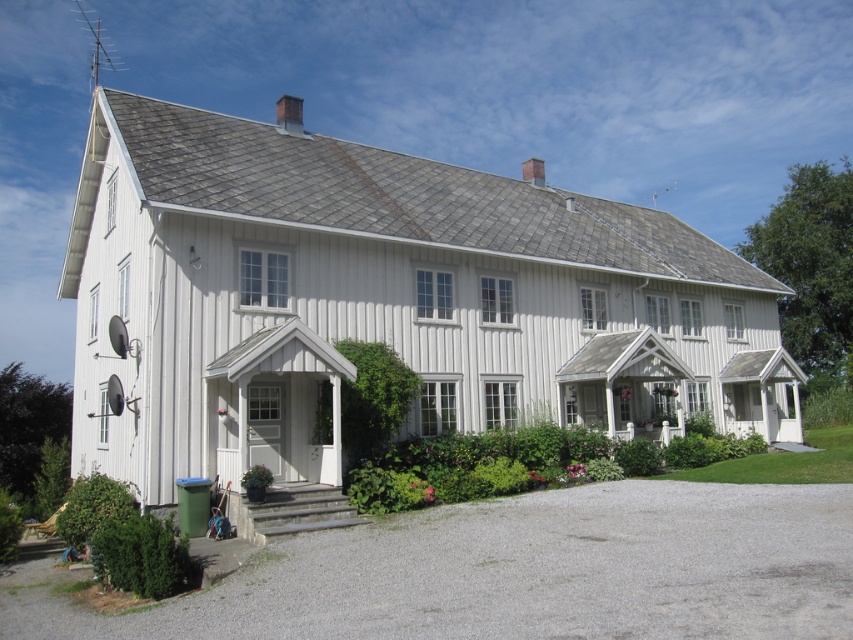
You are a delivery person approaching the house and need to park your vehicle. The gray gravel driveway at lower center and the gray stone steps at lower center are both visible. Which path is wider and more suitable for parking?

The gray gravel driveway at lower center is wider than the gray stone steps at lower center, making it more suitable for parking.

You are a gardener planning to plant flowers along the gray gravel driveway at lower center and the gray stone steps at lower center. Which area requires more soil and plants due to its size?

The gray gravel driveway at lower center requires more soil and plants because it is bigger than the gray stone steps at lower center.

You are a delivery person approaching the house and need to reach the front entrance. You see the gray gravel driveway at lower center and the gray stone steps at lower center. Which path should you take to get to the entrance?

You should take the gray gravel driveway at lower center because it is closer to the viewer and leads directly to the entrance, while the gray stone steps at lower center are further away.